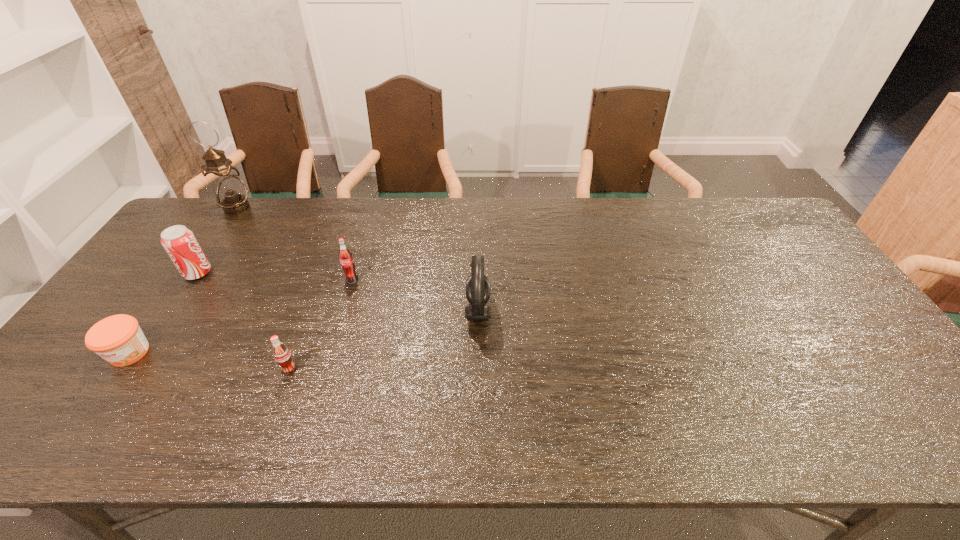
Locate an element on the screen. The height and width of the screenshot is (540, 960). blank space located 0.240m on the earcups of the rightmost object is located at coordinates (578, 311).

Locate an element on the screen. free space located on the logo side of the leftmost soda is located at coordinates (275, 273).

Where is `free region located on the label of the fifth object from left to right`? Image resolution: width=960 pixels, height=540 pixels. free region located on the label of the fifth object from left to right is located at coordinates (327, 361).

Identify the location of vacant space located 0.380m on the right of the shortest soda. This screenshot has height=540, width=960. (452, 369).

Where is `vacant region located 0.120m on the front label of the shortest object`? The width and height of the screenshot is (960, 540). vacant region located 0.120m on the front label of the shortest object is located at coordinates (85, 416).

Identify the location of object situated at the far edge. The height and width of the screenshot is (540, 960). (230, 192).

This screenshot has height=540, width=960. What are the coordinates of `oil lamp at the left edge` in the screenshot? It's located at (230, 192).

You are a GUI agent. You are given a task and a screenshot of the screen. Output one action in this format:
    pyautogui.click(x=<x>, y=<y>)
    Task: Click on the soda can located at the left edge
    
    Given the screenshot: What is the action you would take?
    pyautogui.click(x=179, y=242)

You are a GUI agent. You are given a task and a screenshot of the screen. Output one action in this format:
    pyautogui.click(x=<x>, y=<y>)
    Task: Click on the jam that is at the left edge
    This screenshot has height=540, width=960.
    Given the screenshot: What is the action you would take?
    pyautogui.click(x=118, y=339)

I want to click on object located at the far left corner, so pyautogui.click(x=230, y=192).